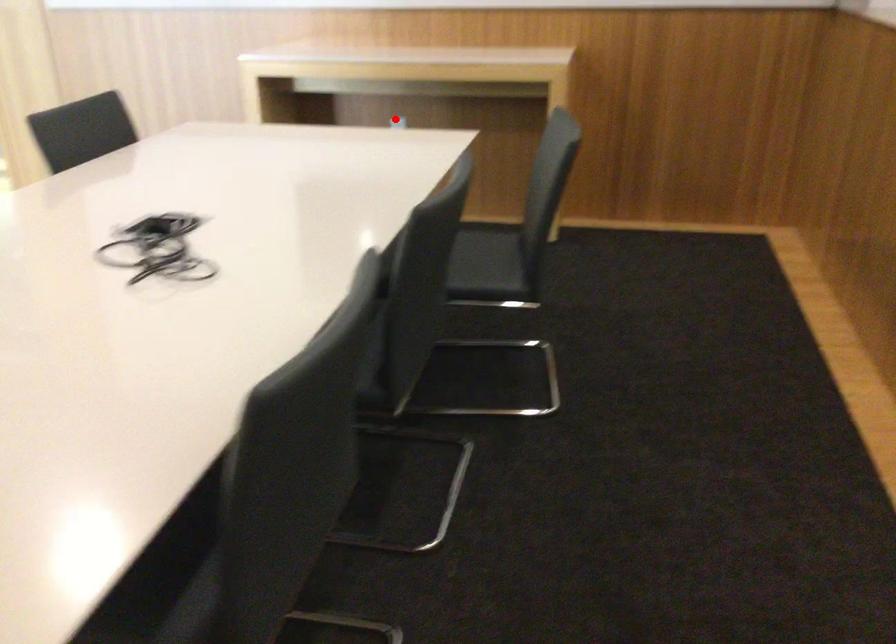
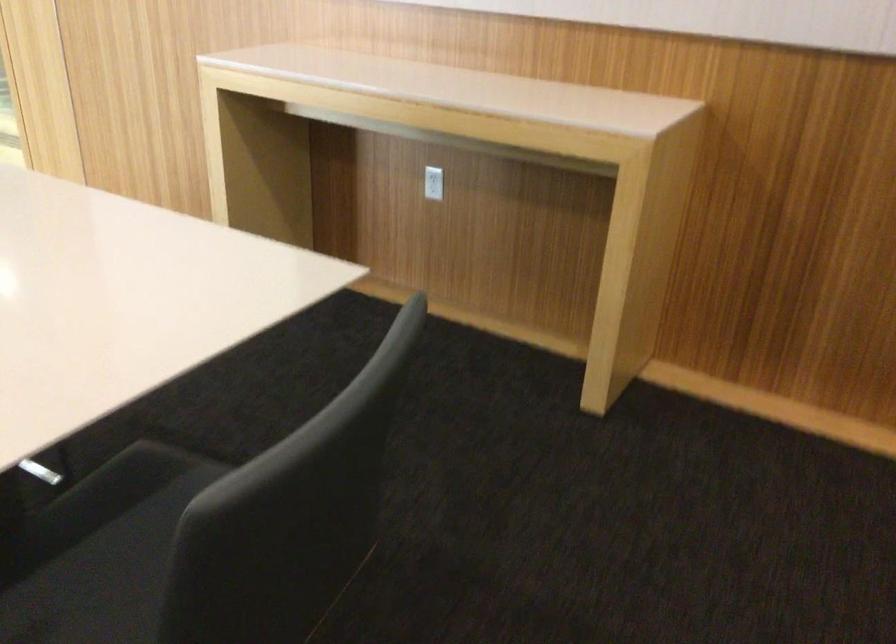
Where in the second image is the point corresponding to the highlighted location from the first image?

(433, 183)